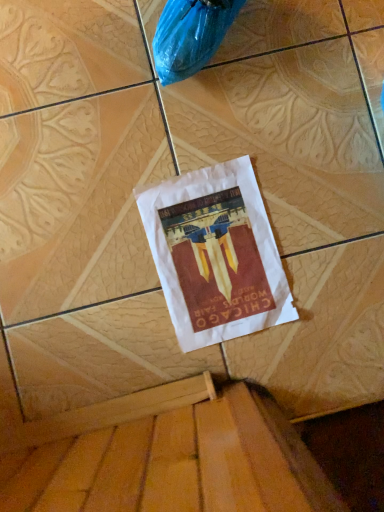
Where is `vacant space situated above white paper at center (from a real-world perspective)`? The height and width of the screenshot is (512, 384). vacant space situated above white paper at center (from a real-world perspective) is located at coordinates (218, 256).